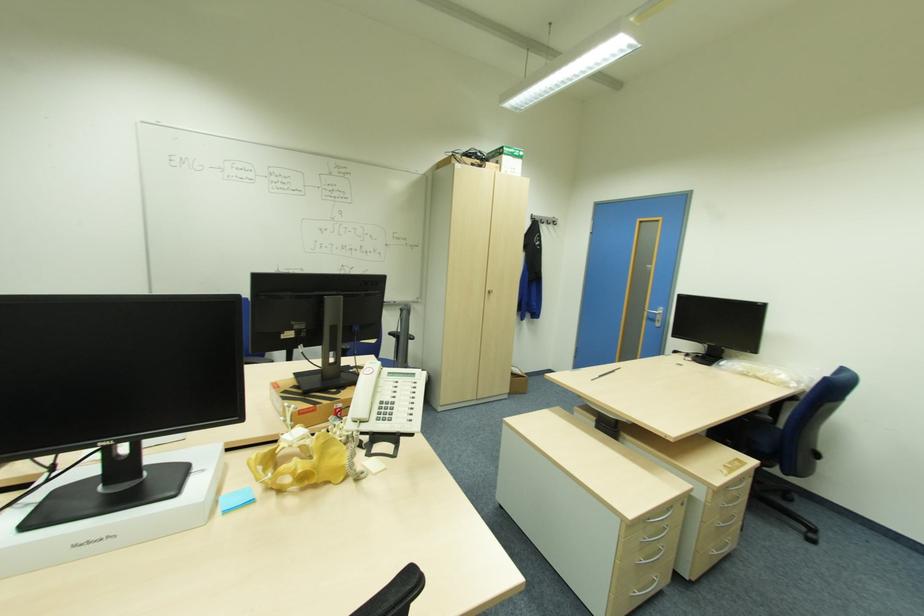
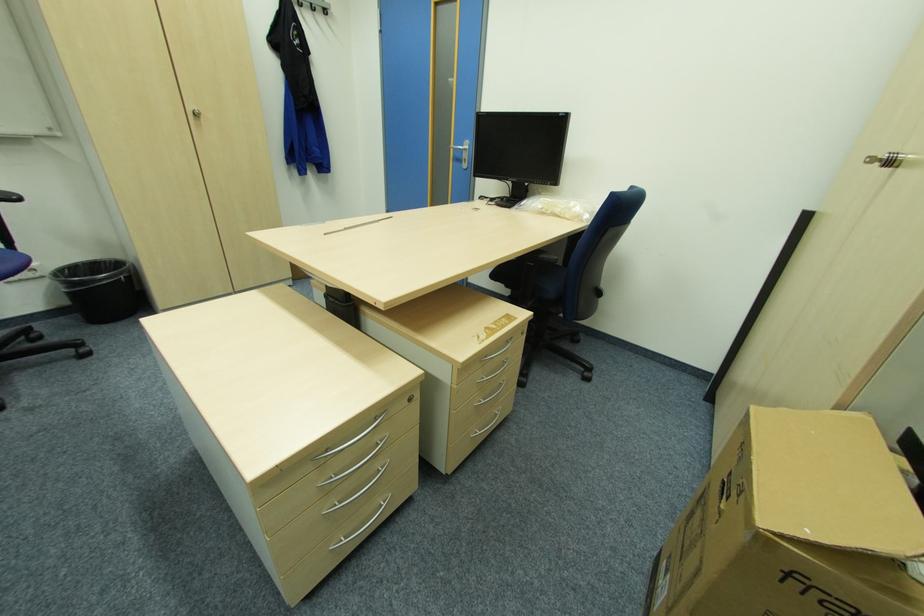
The point at (492, 292) is marked in the first image. Where is the corresponding point in the second image?

(198, 114)